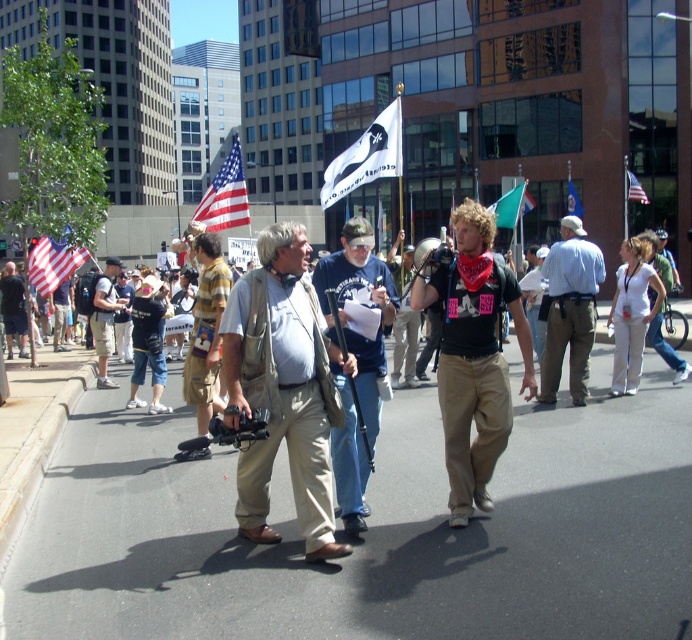
Question: Which object is positioned closest to the american flag at upper center?

Choices:
 (A) american flag at center
 (B) matte black camera at center
 (C) khaki shorts at center
 (D) striped cotton shirt at center

Answer: (C)

Question: Is matte black camera at center thinner than striped cotton shirt at center?

Choices:
 (A) yes
 (B) no

Answer: (B)

Question: Which object is the farthest from the blue shirt at center?

Choices:
 (A) striped cotton shirt at center
 (B) american flag at left

Answer: (B)

Question: Which object is positioned closest to the khaki pants at center?

Choices:
 (A) american flag at center
 (B) blue fabric flag at center
 (C) blue shirt at center

Answer: (C)

Question: Can you confirm if striped cotton shirt at center is positioned below white fabric flag at center?

Choices:
 (A) yes
 (B) no

Answer: (A)

Question: Is khaki shorts at center positioned behind american flag at left?

Choices:
 (A) no
 (B) yes

Answer: (A)